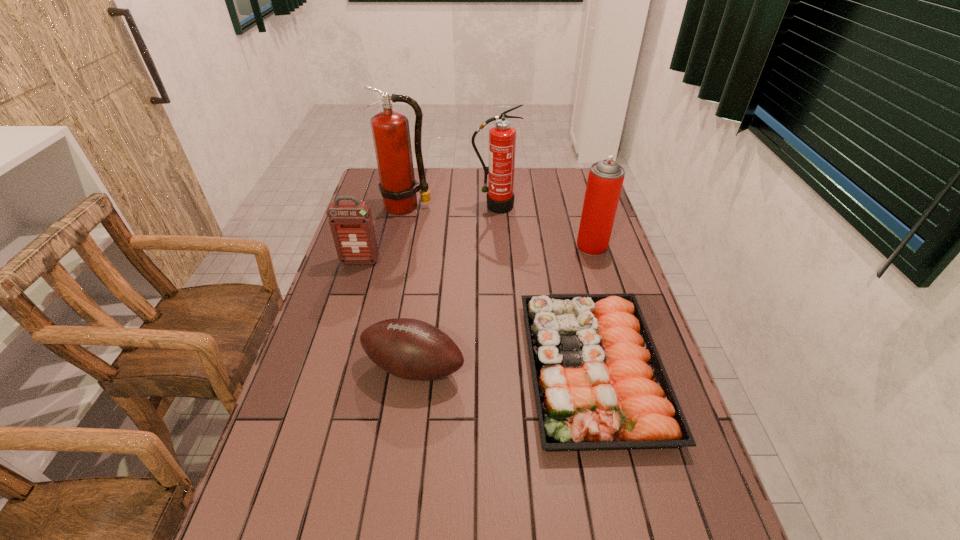
In order to click on the left fire extinguisher in this screenshot , I will do `click(390, 129)`.

Locate an element on the screen. The height and width of the screenshot is (540, 960). the shorter fire extinguisher is located at coordinates (502, 137).

This screenshot has height=540, width=960. I want to click on aerosol can, so click(x=605, y=180).

Image resolution: width=960 pixels, height=540 pixels. Identify the location of the fourth shortest object. (605, 180).

You are a GUI agent. You are given a task and a screenshot of the screen. Output one action in this format:
    pyautogui.click(x=<x>, y=<y>)
    Task: Click on the third shortest object
    The image size is (960, 540).
    Given the screenshot: What is the action you would take?
    pyautogui.click(x=351, y=223)

Locate an element on the screen. The width and height of the screenshot is (960, 540). the first-aid kit is located at coordinates (351, 223).

At what (x,y) coordinates should I click in order to perform the action: click on the fifth tallest object. Please return your answer as a coordinate pair (x, y). Looking at the image, I should click on (411, 349).

At what (x,y) coordinates should I click in order to perform the action: click on the shortest object. Please return your answer as a coordinate pair (x, y). This screenshot has height=540, width=960. Looking at the image, I should click on (599, 382).

This screenshot has height=540, width=960. Identify the location of free location located at the nozzle of the left fire extinguisher. (390, 284).

At what (x,y) coordinates should I click in order to perform the action: click on free space located 0.390m on the front-facing side of the shorter fire extinguisher. Please return your answer as a coordinate pair (x, y). The height and width of the screenshot is (540, 960). Looking at the image, I should click on (498, 285).